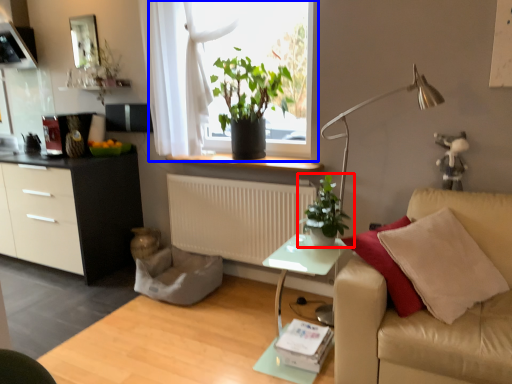
Question: Which of the following is the farthest to the observer, houseplant (highlighted by a red box) or window (highlighted by a blue box)?

Choices:
 (A) houseplant
 (B) window

Answer: (B)